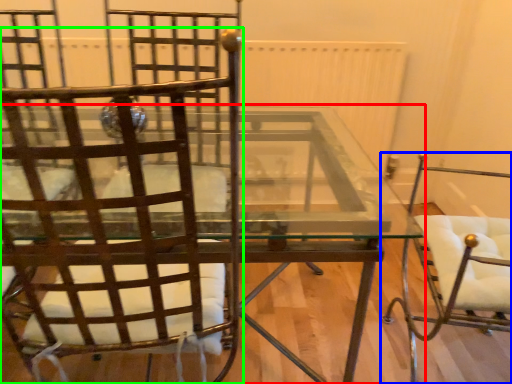
Question: Which object is positioned closest to table (highlighted by a red box)? Select from chair (highlighted by a blue box) and chair (highlighted by a green box).

Choices:
 (A) chair
 (B) chair

Answer: (B)